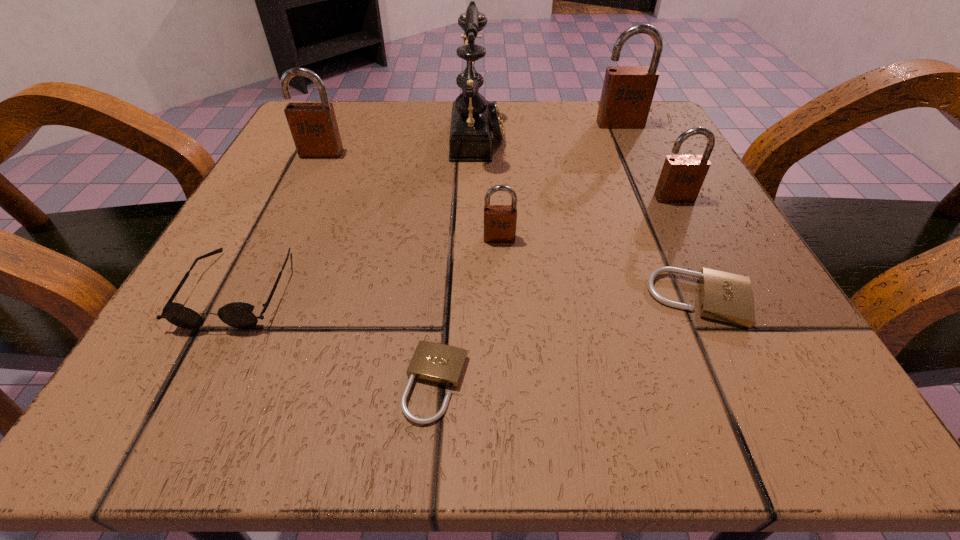
Where is `vacant space located on the back of the second shortest padlock`? Image resolution: width=960 pixels, height=540 pixels. vacant space located on the back of the second shortest padlock is located at coordinates (631, 147).

At what (x,y) coordinates should I click in order to perform the action: click on vacant region located 0.240m on the left of the nearer beige padlock. Please return your answer as a coordinate pair (x, y). The width and height of the screenshot is (960, 540). Looking at the image, I should click on (178, 383).

In order to click on telephone that is at the far edge in this screenshot , I will do `click(474, 119)`.

Where is `object that is at the near edge`? This screenshot has height=540, width=960. object that is at the near edge is located at coordinates (441, 364).

What are the coordinates of `padlock that is at the left edge` in the screenshot? It's located at (314, 128).

This screenshot has height=540, width=960. Identify the location of sunglasses that is at the left edge. (239, 315).

Identify the location of object that is at the far left corner. pyautogui.click(x=314, y=128).

At what (x,y) coordinates should I click in order to perform the action: click on object at the far right corner. Please return your answer as a coordinate pair (x, y). Looking at the image, I should click on (627, 93).

Locate an element on the screen. This screenshot has width=960, height=540. blank space at the far edge is located at coordinates (539, 137).

Find the location of a particular element. free region at the near edge is located at coordinates (522, 415).